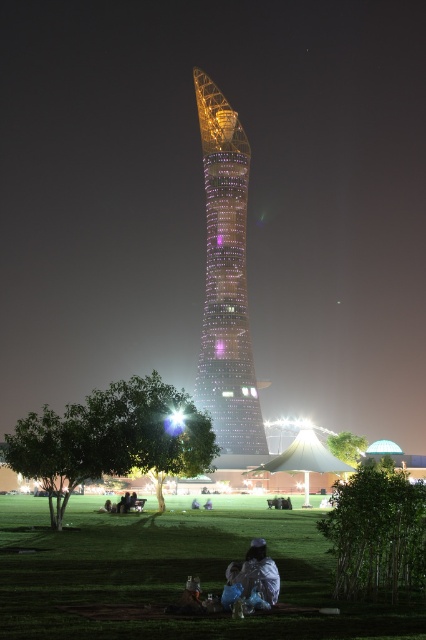
You are planning to set up a picnic blanket for a group of 10 people. Given the scene, can the green grass at lower center accommodate the space needed for the group compared to the shiny glass tower at center?

The green grass at lower center is wider than the shiny glass tower at center, so it can accommodate the space needed for the group of 10 people.

You are standing on the grassy area in the scene and want to place your white fabric bag at lower center on the ground. Is there enough space between the green grass at lower center and the tower to place it without it being in the way of the grass?

The green grass at lower center is located below the white fabric bag at lower center, so placing the white fabric bag at lower center on the grass would cover part of the green grass at lower center. Therefore, it might not leave enough space if you want to keep the grass visible.